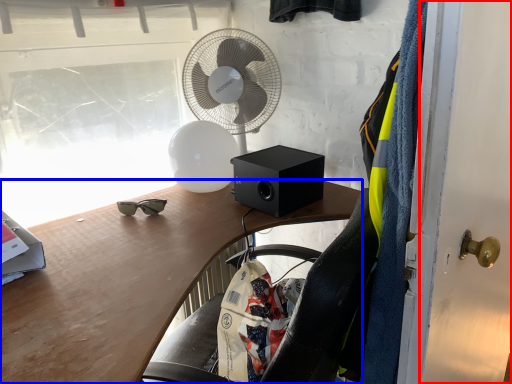
Question: Which object is closer to the camera taking this photo, door (highlighted by a red box) or desk (highlighted by a blue box)?

Choices:
 (A) door
 (B) desk

Answer: (A)